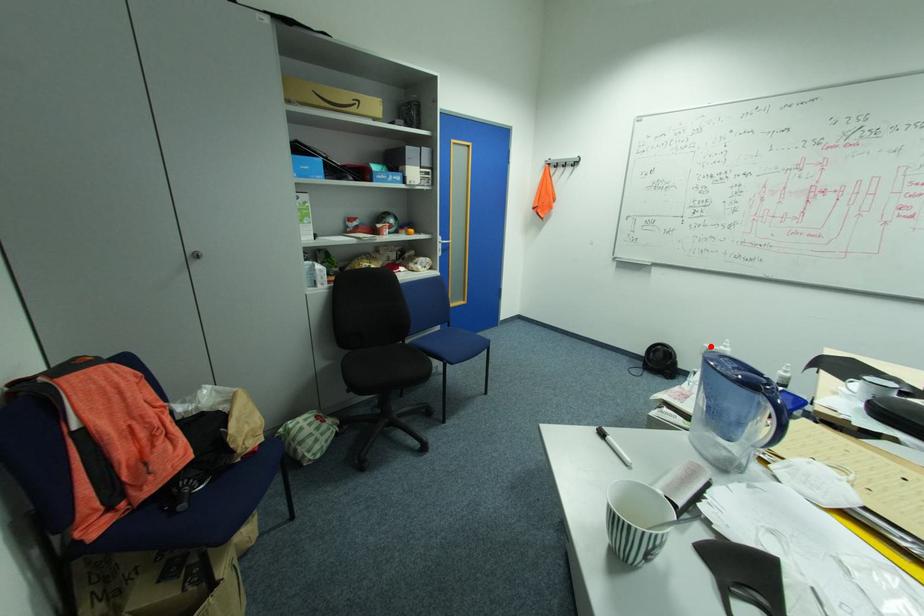
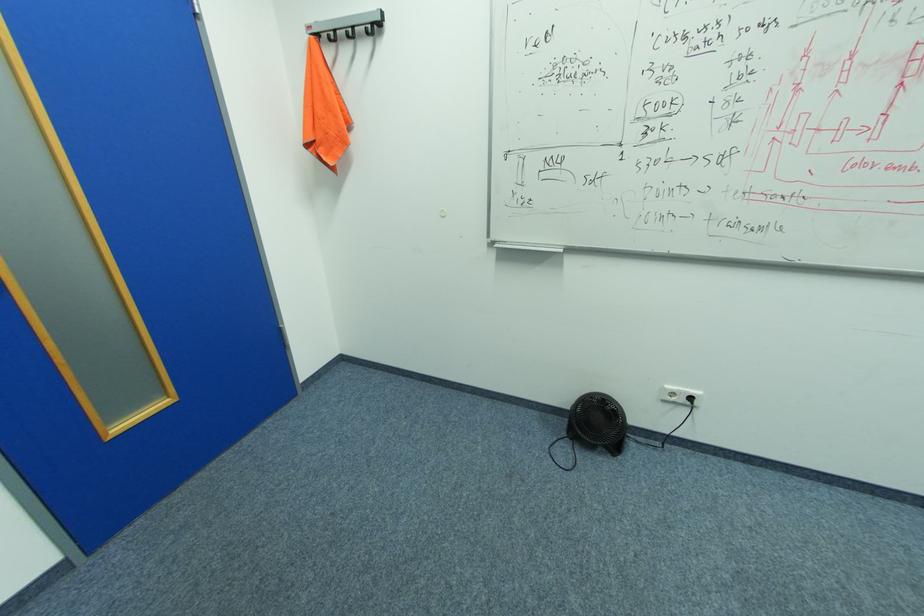
Where in the second image is the point corresponding to the highlighted location from the first image?

(670, 387)